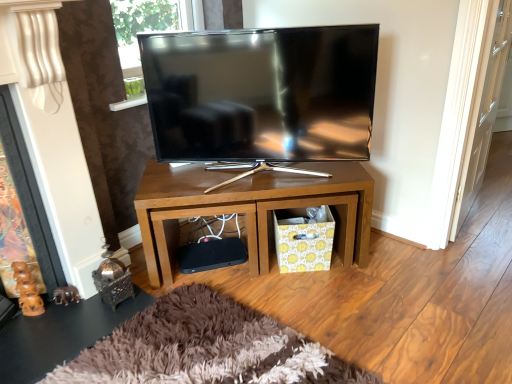
Question: Is the position of matte black tv at center more distant than that of wooden tv stand at center?

Choices:
 (A) no
 (B) yes

Answer: (A)

Question: Are matte black tv at center and wooden tv stand at center located far from each other?

Choices:
 (A) yes
 (B) no

Answer: (B)

Question: Does matte black tv at center appear on the right side of wooden tv stand at center?

Choices:
 (A) no
 (B) yes

Answer: (A)

Question: Is matte black tv at center wider than wooden tv stand at center?

Choices:
 (A) no
 (B) yes

Answer: (A)

Question: From the image's perspective, is matte black tv at center on top of wooden tv stand at center?

Choices:
 (A) no
 (B) yes

Answer: (B)

Question: Is matte black tv at center bigger or smaller than wooden tv stand at center?

Choices:
 (A) small
 (B) big

Answer: (A)

Question: Is matte black tv at center in front of or behind wooden tv stand at center in the image?

Choices:
 (A) front
 (B) behind

Answer: (A)

Question: Is matte black tv at center to the left or to the right of wooden tv stand at center in the image?

Choices:
 (A) right
 (B) left

Answer: (B)

Question: Is matte black tv at center taller or shorter than wooden tv stand at center?

Choices:
 (A) tall
 (B) short

Answer: (A)

Question: Looking at their shapes, would you say transparent glass door at right is wider or thinner than wooden tv stand at center?

Choices:
 (A) thin
 (B) wide

Answer: (A)

Question: From the image's perspective, is transparent glass door at right above or below wooden tv stand at center?

Choices:
 (A) below
 (B) above

Answer: (B)

Question: Relative to wooden tv stand at center, is transparent glass door at right in front or behind?

Choices:
 (A) front
 (B) behind

Answer: (A)

Question: Is transparent glass door at right inside the boundaries of wooden tv stand at center, or outside?

Choices:
 (A) outside
 (B) inside

Answer: (A)

Question: Do you think brown wood fireplace at left is within shiny metallic side table at lower left, or outside of it?

Choices:
 (A) inside
 (B) outside

Answer: (B)

Question: In terms of width, does brown wood fireplace at left look wider or thinner when compared to shiny metallic side table at lower left?

Choices:
 (A) thin
 (B) wide

Answer: (A)